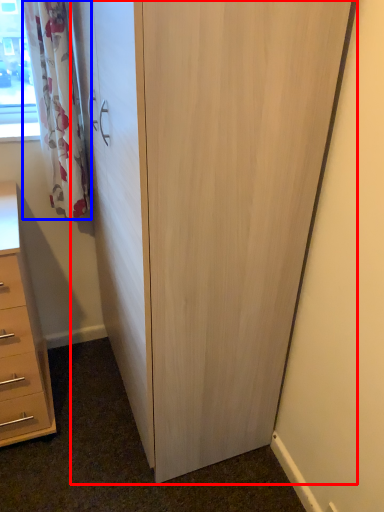
Question: Which of the following is the farthest to the observer, cupboard (highlighted by a red box) or curtain (highlighted by a blue box)?

Choices:
 (A) cupboard
 (B) curtain

Answer: (B)